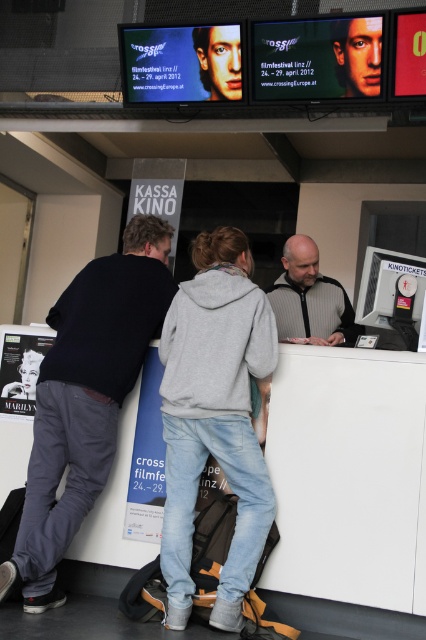
Can you confirm if gray hoodie at center is taller than gray striped jacket at center?

Yes, gray hoodie at center is taller than gray striped jacket at center.

Between gray hoodie at center and gray striped jacket at center, which one is positioned lower?

gray hoodie at center is below.

Image resolution: width=426 pixels, height=640 pixels. Find the location of `gray hoodie at center`. gray hoodie at center is located at coordinates (215, 417).

Does dark gray sweater at left have a smaller size compared to gray striped jacket at center?

No.

Is point (88, 440) more distant than point (340, 317)?

No, (88, 440) is in front of (340, 317).

At what (x,y) coordinates should I click in order to perform the action: click on dark gray sweater at left. Please return your answer as a coordinate pair (x, y). This screenshot has height=640, width=426. Looking at the image, I should click on (86, 397).

Is gray hoodie at center to the right of dark gray sweater at left from the viewer's perspective?

Indeed, gray hoodie at center is positioned on the right side of dark gray sweater at left.

Is gray hoodie at center taller than dark gray sweater at left?

No, gray hoodie at center is not taller than dark gray sweater at left.

Is point (247, 346) in front of point (140, 268)?

Yes, point (247, 346) is in front of point (140, 268).

In order to click on gray hoodie at center in this screenshot , I will do `click(215, 417)`.